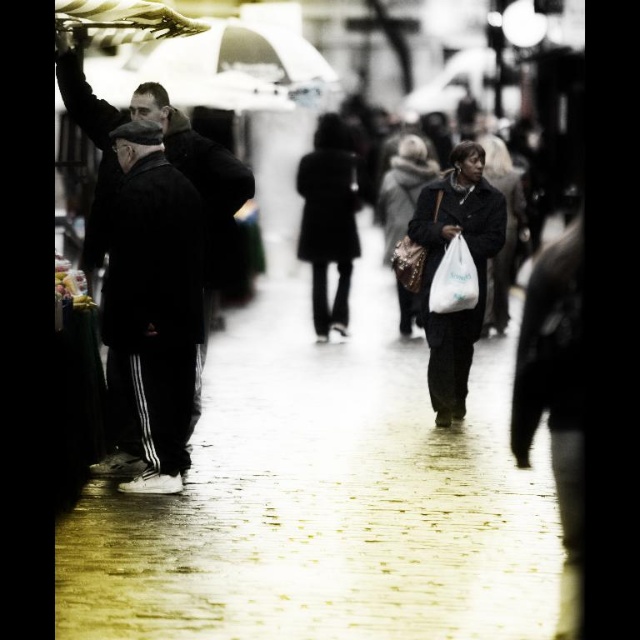
Question: Which point appears closest to the camera in this image?

Choices:
 (A) (141, 426)
 (B) (419, 198)
 (C) (92, 4)
 (D) (548, 529)

Answer: (C)

Question: Which of these objects is positioned farthest from the black matte pants at left?

Choices:
 (A) transparent plastic umbrella at upper left
 (B) white plastic bag at center-right
 (C) matte black coat at center

Answer: (C)

Question: Among these objects, which one is farthest from the camera?

Choices:
 (A) matte black coat at center
 (B) black matte pants at left

Answer: (A)

Question: Is matte black coat at center in front of white plastic bag at center-right?

Choices:
 (A) no
 (B) yes

Answer: (A)

Question: Is wet brick pavement at center above matte black coat at center?

Choices:
 (A) no
 (B) yes

Answer: (A)

Question: Considering the relative positions of wet brick pavement at center and matte black coat at center in the image provided, where is wet brick pavement at center located with respect to matte black coat at center?

Choices:
 (A) right
 (B) left

Answer: (B)